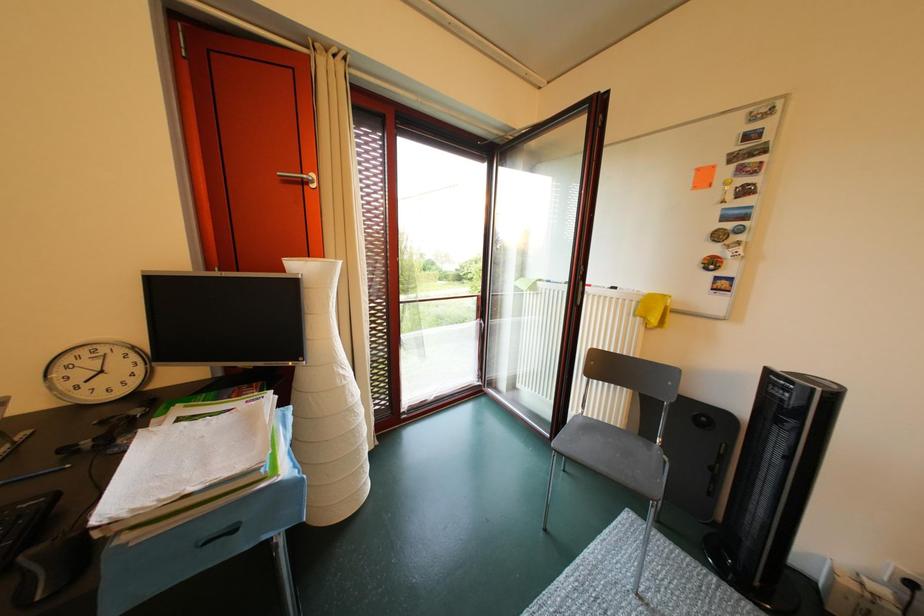
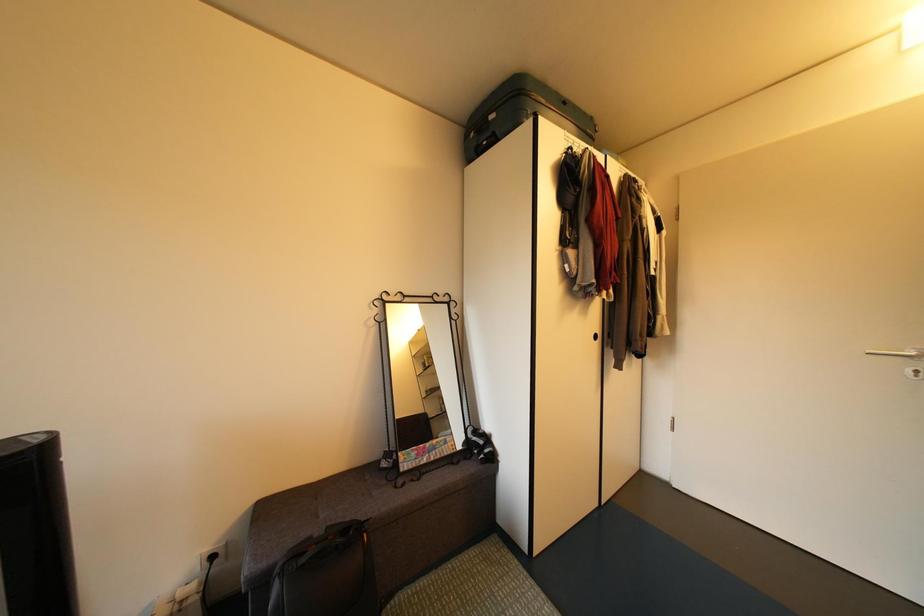
Question: The camera is either moving clockwise (left) or counter-clockwise (right) around the object. The first image is from the beginning of the video and the second image is from the end. Is the camera moving left or right when shooting the video?

Choices:
 (A) Left
 (B) Right

Answer: (A)